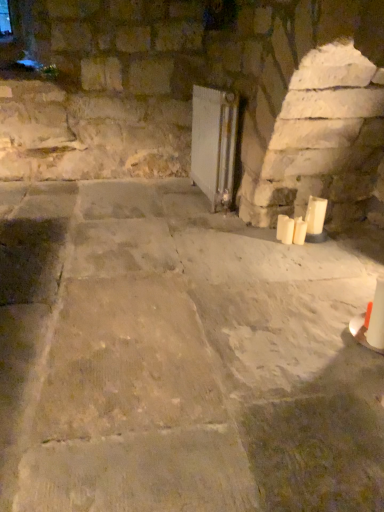
Question: Is white matte candle at right, which is the 1th candle from left to right, beside white matte candle at lower right, the second candle in the left-to-right sequence?

Choices:
 (A) yes
 (B) no

Answer: (A)

Question: Is white matte candle at right, which is the 1th candle from left to right, completely or partially outside of white matte candle at lower right, the second candle positioned from the right?

Choices:
 (A) yes
 (B) no

Answer: (A)

Question: Can you confirm if white matte candle at right, which is the 1th candle from left to right, is taller than white matte candle at lower right, the second candle in the left-to-right sequence?

Choices:
 (A) no
 (B) yes

Answer: (A)

Question: From the image's perspective, is white matte candle at right, the third candle positioned from the right, under white matte candle at lower right, the second candle positioned from the right?

Choices:
 (A) yes
 (B) no

Answer: (B)

Question: From a real-world perspective, is white matte candle at right, which is the 1th candle from left to right, located higher than white matte candle at lower right, the second candle positioned from the right?

Choices:
 (A) yes
 (B) no

Answer: (A)

Question: Can you confirm if white glossy radiator at center is thinner than white matte candle at right, which is counted as the third candle, starting from the left?

Choices:
 (A) no
 (B) yes

Answer: (A)

Question: Is white matte candle at right, the first candle when ordered from right to left, inside white glossy radiator at center?

Choices:
 (A) no
 (B) yes

Answer: (A)

Question: Is white glossy radiator at center to the left of white matte candle at right, the first candle when ordered from right to left, from the viewer's perspective?

Choices:
 (A) no
 (B) yes

Answer: (B)

Question: Are white glossy radiator at center and white matte candle at right, the first candle when ordered from right to left, making contact?

Choices:
 (A) yes
 (B) no

Answer: (B)

Question: Is white glossy radiator at center bigger than white matte candle at right, the first candle when ordered from right to left?

Choices:
 (A) yes
 (B) no

Answer: (A)

Question: Is white glossy radiator at center shorter than white matte candle at right, the first candle when ordered from right to left?

Choices:
 (A) no
 (B) yes

Answer: (A)

Question: Does white matte candle at lower right, the second candle positioned from the right, come in front of white glossy radiator at center?

Choices:
 (A) no
 (B) yes

Answer: (B)